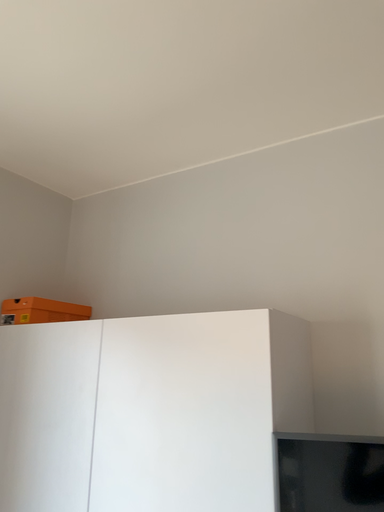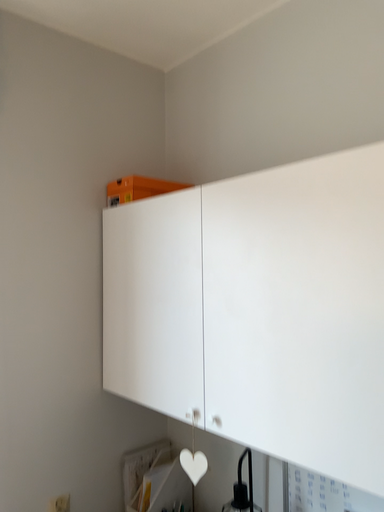
Question: How did the camera likely rotate when shooting the video?

Choices:
 (A) rotated downward
 (B) rotated upward

Answer: (A)